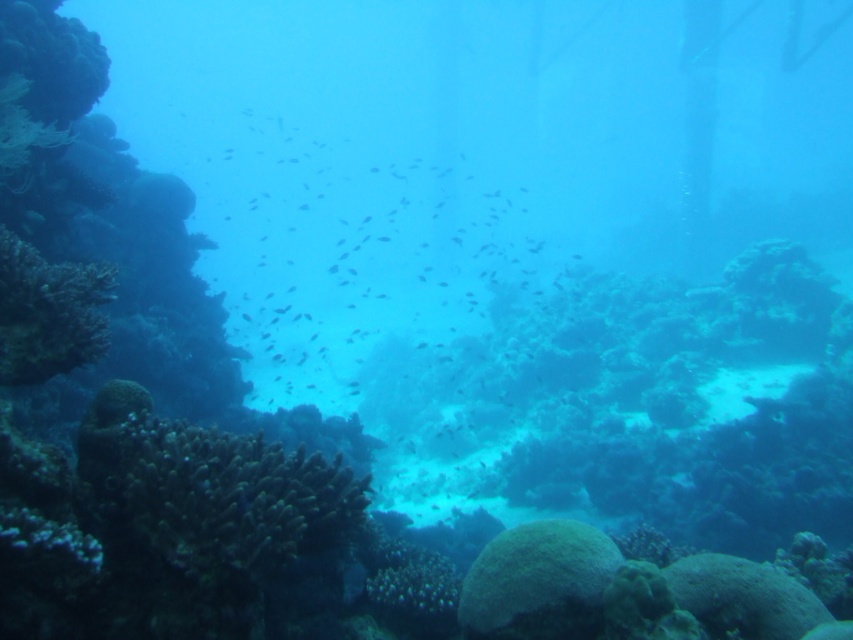
Is point (259, 336) positioned behind point (137, 483)?

Yes, point (259, 336) is behind point (137, 483).

Who is more forward, (473, 289) or (268, 499)?

Point (268, 499) is in front.

The height and width of the screenshot is (640, 853). I want to click on dark blue matte fish at center, so click(357, 237).